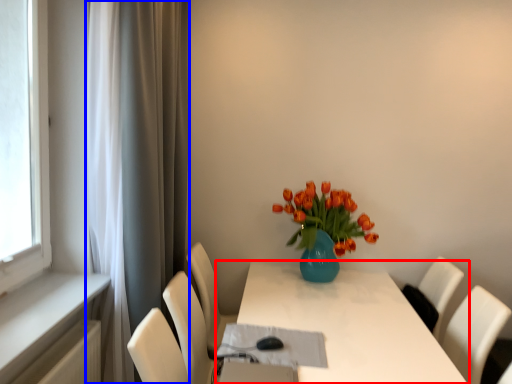
Question: Which of the following is the farthest to the observer, table (highlighted by a red box) or curtain (highlighted by a blue box)?

Choices:
 (A) table
 (B) curtain

Answer: (B)